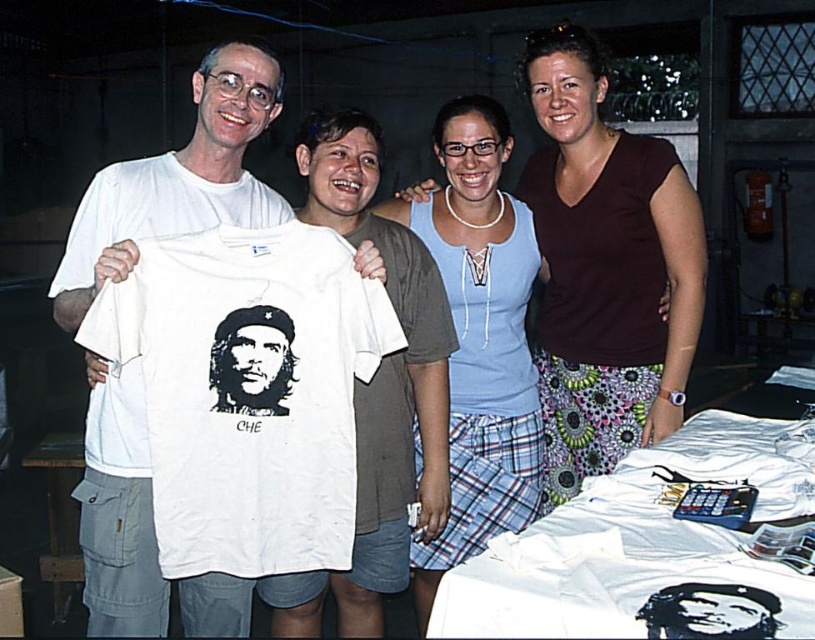
Question: Which object is farther from the camera taking this photo?

Choices:
 (A) matte blue tank top at center
 (B) white cotton t-shirt at center

Answer: (A)

Question: Is white cotton t-shirt at center further to the viewer compared to matte blue tank top at center?

Choices:
 (A) no
 (B) yes

Answer: (A)

Question: Among these objects, which one is farthest from the camera?

Choices:
 (A) matte blue tank top at center
 (B) white cotton t-shirt at center

Answer: (A)

Question: Is white cotton t-shirt at center smaller than matte blue tank top at center?

Choices:
 (A) no
 (B) yes

Answer: (B)

Question: Can you confirm if white cotton t-shirt at center is positioned to the left of matte blue tank top at center?

Choices:
 (A) yes
 (B) no

Answer: (A)

Question: Which object is closer to the camera taking this photo?

Choices:
 (A) white cotton t-shirt at center
 (B) matte blue tank top at center

Answer: (A)